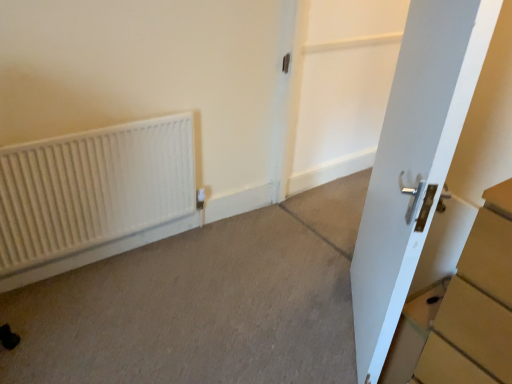
This screenshot has height=384, width=512. What do you see at coordinates (93, 188) in the screenshot?
I see `white matte radiator at left` at bounding box center [93, 188].

What do you see at coordinates (341, 87) in the screenshot? I see `white glossy door at center` at bounding box center [341, 87].

Locate an element on the screen. This screenshot has height=384, width=512. gray carpet at lower left is located at coordinates pyautogui.click(x=203, y=304).

Image resolution: width=512 pixels, height=384 pixels. I want to click on white matte radiator at left, so click(x=93, y=188).

Would you say white glossy door at right is inside or outside white glossy door at center?

white glossy door at right exists outside the volume of white glossy door at center.

Is white glossy door at right positioned far away from white glossy door at center?

Yes.

Considering the sizes of objects white glossy door at right and white glossy door at center in the image provided, who is thinner, white glossy door at right or white glossy door at center?

With smaller width is white glossy door at right.

Which is more to the right, gray carpet at lower left or white glossy door at center?

white glossy door at center is more to the right.

Considering the positions of points (311, 363) and (353, 153), is point (311, 363) farther from camera compared to point (353, 153)?

That is False.

From the image's perspective, which is below, gray carpet at lower left or white glossy door at center?

gray carpet at lower left is shown below in the image.

Does gray carpet at lower left have a greater width compared to white glossy door at center?

Yes, gray carpet at lower left is wider than white glossy door at center.

Consider the image. Is white matte radiator at left in front of white glossy door at right?

No, white matte radiator at left is further to the viewer.

From the image's perspective, would you say white matte radiator at left is positioned over white glossy door at right?

No, from the image's perspective, white matte radiator at left is not over white glossy door at right.

What's the angular difference between white matte radiator at left and white glossy door at right's facing directions?

They differ by 133 degrees in their facing directions.

Between gray carpet at lower left and white matte radiator at left, which one appears on the right side from the viewer's perspective?

gray carpet at lower left.

Is gray carpet at lower left surrounding white matte radiator at left?

No, gray carpet at lower left does not contain white matte radiator at left.

Identify the location of radiator to the left of gray carpet at lower left. (93, 188).

From the image's perspective, which one is positioned higher, gray carpet at lower left or white matte radiator at left?

From the image's view, white matte radiator at left is above.

Is white matte radiator at left located outside gray carpet at lower left?

That's correct, white matte radiator at left is outside of gray carpet at lower left.

How far apart are white matte radiator at left and gray carpet at lower left?

A distance of 19.60 inches exists between white matte radiator at left and gray carpet at lower left.

What are the coordinates of `concrete lying on the right of white matte radiator at left` in the screenshot? It's located at (203, 304).

Which point is more forward, [340,143] or [152,251]?

The point [152,251] is closer.

In the image, is white glossy door at center positioned in front of or behind gray carpet at lower left?

Visually, white glossy door at center is located behind gray carpet at lower left.

Considering the sizes of white glossy door at center and gray carpet at lower left in the image, is white glossy door at center taller or shorter than gray carpet at lower left?

white glossy door at center is taller than gray carpet at lower left.

Based on their sizes in the image, would you say white glossy door at center is bigger or smaller than gray carpet at lower left?

Considering their sizes, white glossy door at center takes up more space than gray carpet at lower left.

Can you confirm if white glossy door at right is smaller than gray carpet at lower left?

No.

From the picture: Is white glossy door at right oriented away from gray carpet at lower left?

No, gray carpet at lower left is not at the back of white glossy door at right.

Is white glossy door at right at the left side of gray carpet at lower left?

No.

Is white glossy door at right beside gray carpet at lower left?

No, white glossy door at right is not making contact with gray carpet at lower left.

Identify the location of door that appears in front of the white glossy door at center. (414, 162).

Where is `concrete on the left of white glossy door at center`? This screenshot has height=384, width=512. concrete on the left of white glossy door at center is located at coordinates (203, 304).

From the image, which object appears to be farther from gray carpet at lower left, white glossy door at right or white matte radiator at left?

Based on the image, white glossy door at right appears to be further to gray carpet at lower left.

From the picture: Estimate the real-world distances between objects in this image. Which object is further from white matte radiator at left, white glossy door at center or gray carpet at lower left?

white glossy door at center lies further to white matte radiator at left than the other object.

From the image, which object appears to be farther from gray carpet at lower left, white glossy door at center or white matte radiator at left?

Among the two, white glossy door at center is located further to gray carpet at lower left.

In the scene shown: Based on their spatial positions, is white matte radiator at left or white glossy door at center further from gray carpet at lower left?

white glossy door at center lies further to gray carpet at lower left than the other object.

Which object lies nearer to the anchor point white glossy door at center, white glossy door at right or white matte radiator at left?

white matte radiator at left lies closer to white glossy door at center than the other object.

From the image, which object appears to be farther from white glossy door at center, gray carpet at lower left or white matte radiator at left?

Among the two, white matte radiator at left is located further to white glossy door at center.

Considering their positions, is white matte radiator at left positioned closer to white glossy door at right than gray carpet at lower left?

The object closer to white glossy door at right is gray carpet at lower left.

From the picture: When comparing their distances from white glossy door at right, does white glossy door at center or white matte radiator at left seem further?

Among the two, white glossy door at center is located further to white glossy door at right.

I want to click on concrete between white matte radiator at left and white glossy door at center in the horizontal direction, so click(x=203, y=304).

Identify the location of concrete between white matte radiator at left and white glossy door at right. The width and height of the screenshot is (512, 384). (203, 304).

Identify the location of screen door between white matte radiator at left and white glossy door at right in the horizontal direction. This screenshot has width=512, height=384. (341, 87).

Locate an element on the screen. The image size is (512, 384). door that lies between white glossy door at center and gray carpet at lower left from top to bottom is located at coordinates (414, 162).